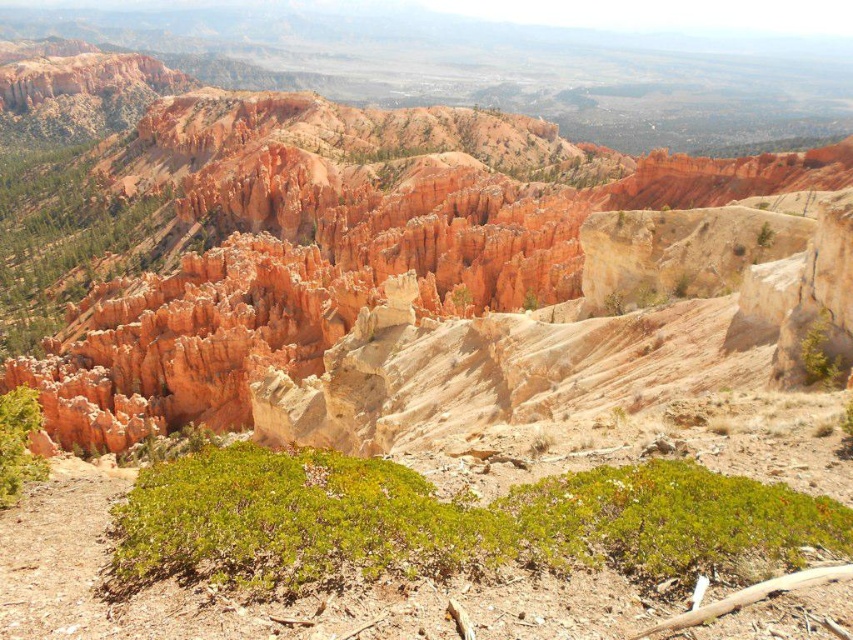
Who is shorter, green shrubbery at center or green shrubbery at left?

green shrubbery at center is shorter.

Is point (653, 538) positioned behind point (27, 307)?

No, (653, 538) is in front of (27, 307).

At what (x,y) coordinates should I click in order to perform the action: click on green shrubbery at center. Please return your answer as a coordinate pair (x, y). Looking at the image, I should click on (450, 524).

The width and height of the screenshot is (853, 640). What are the coordinates of `green shrubbery at center` in the screenshot? It's located at (450, 524).

Is green shrubbery at left to the left of green leafy bush at lower left from the viewer's perspective?

Yes, green shrubbery at left is to the left of green leafy bush at lower left.

Can you confirm if green shrubbery at left is smaller than green leafy bush at lower left?

No, green shrubbery at left is not smaller than green leafy bush at lower left.

What do you see at coordinates (61, 236) in the screenshot?
I see `green shrubbery at left` at bounding box center [61, 236].

This screenshot has height=640, width=853. In order to click on green shrubbery at left in this screenshot , I will do `click(61, 236)`.

Between green shrubbery at center and green leafy bush at lower left, which one is positioned higher?

green leafy bush at lower left is above.

Who is more distant from viewer, (169, 470) or (3, 472)?

Positioned behind is point (169, 470).

Locate an element on the screen. green shrubbery at center is located at coordinates (450, 524).